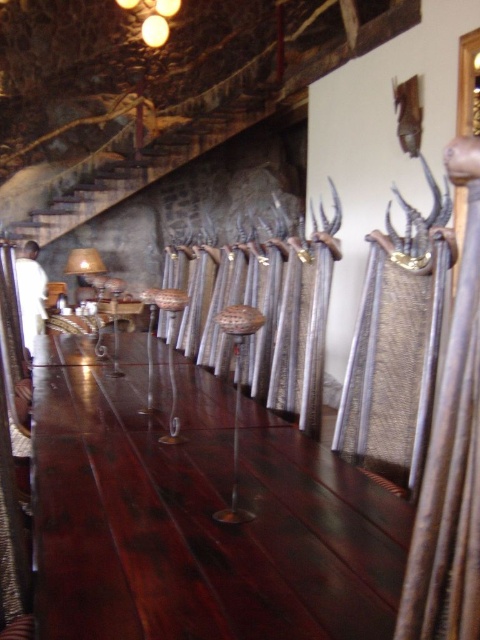
Is mahogany wood table at center below rustic wooden stairs at upper left?

Yes.

Between mahogany wood table at center and rustic wooden stairs at upper left, which one is positioned lower?

mahogany wood table at center

Describe the element at coordinates (197, 516) in the screenshot. I see `mahogany wood table at center` at that location.

Find the location of a particular element. mahogany wood table at center is located at coordinates (197, 516).

Who is higher up, mahogany wood table at center or metallic mesh sculpture at right?

metallic mesh sculpture at right is higher up.

Is mahogany wood table at center thinner than metallic mesh sculpture at right?

No, mahogany wood table at center is not thinner than metallic mesh sculpture at right.

Is point (403, 512) farther from viewer compared to point (440, 291)?

No.

Find the location of a particular element. The width and height of the screenshot is (480, 640). mahogany wood table at center is located at coordinates (197, 516).

Who is positioned more to the right, metallic mesh sculpture at right or rustic wooden stairs at upper left?

metallic mesh sculpture at right

Which is behind, point (406, 253) or point (186, 150)?

Positioned behind is point (186, 150).

Is point (373, 472) positioned after point (62, 230)?

No, it is in front of (62, 230).

Identify the location of metallic mesh sculpture at right. (396, 344).